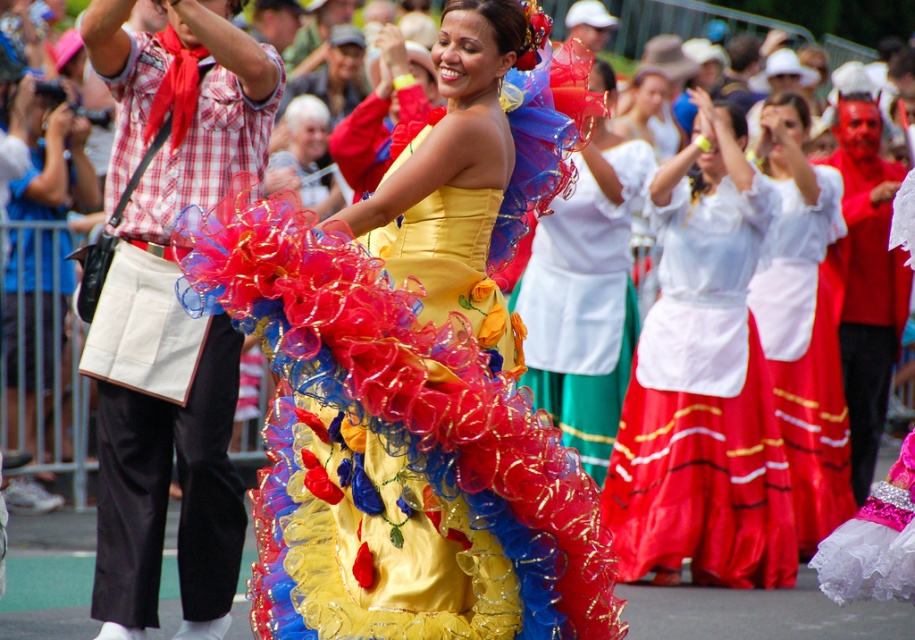
Question: Considering the relative positions of white satin blouse at center and shiny tulle dress at center in the image provided, where is white satin blouse at center located with respect to shiny tulle dress at center?

Choices:
 (A) above
 (B) below

Answer: (B)

Question: Is satin yellow dress at center in front of white satin blouse at upper center?

Choices:
 (A) no
 (B) yes

Answer: (B)

Question: Which point is closer to the camera?

Choices:
 (A) white satin blouse at upper center
 (B) white satin blouse at center
 (C) satin yellow dress at center

Answer: (C)

Question: Can you confirm if satin yellow dress at center is bigger than shiny tulle dress at center?

Choices:
 (A) no
 (B) yes

Answer: (A)

Question: Based on their relative distances, which object is farther from the white satin blouse at upper center?

Choices:
 (A) satin yellow dress at center
 (B) white satin blouse at center
 (C) shiny tulle dress at center

Answer: (A)

Question: Which point is farther to the camera?

Choices:
 (A) (440, 520)
 (B) (579, 426)
 (C) (727, 404)

Answer: (B)